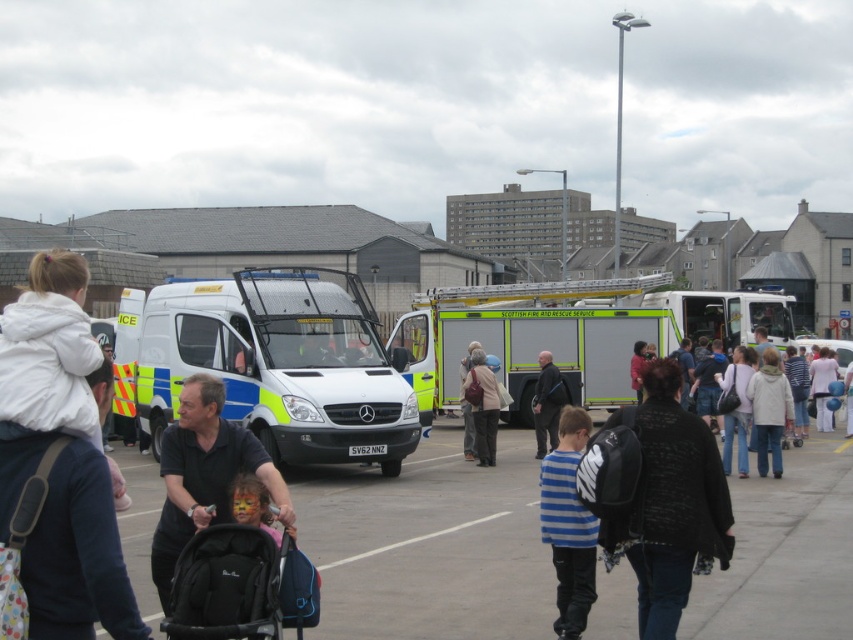
You are a photographer trying to capture a clear shot of both the black backpack at center and the light brown backpack at center. Since you want both backpacks to be fully visible in your photo, which backpack should you focus on first to ensure it doesn not block the other?

The black backpack at center is positioned over light brown backpack at center, so you should focus on the light brown backpack at center first to prevent it from being blocked by the black backpack at center.

You are a photographer trying to capture a clear photo of the light brown leather jacket at center without the black fabric baby carriage at center blocking it. Since the baby carriage is taller, where should you position yourself relative to the baby carriage to ensure the jacket is visible?

Since the black fabric baby carriage at center is taller than the light brown leather jacket at center, positioning yourself behind the black fabric baby carriage at center would allow you to see the light brown leather jacket at center without obstruction.